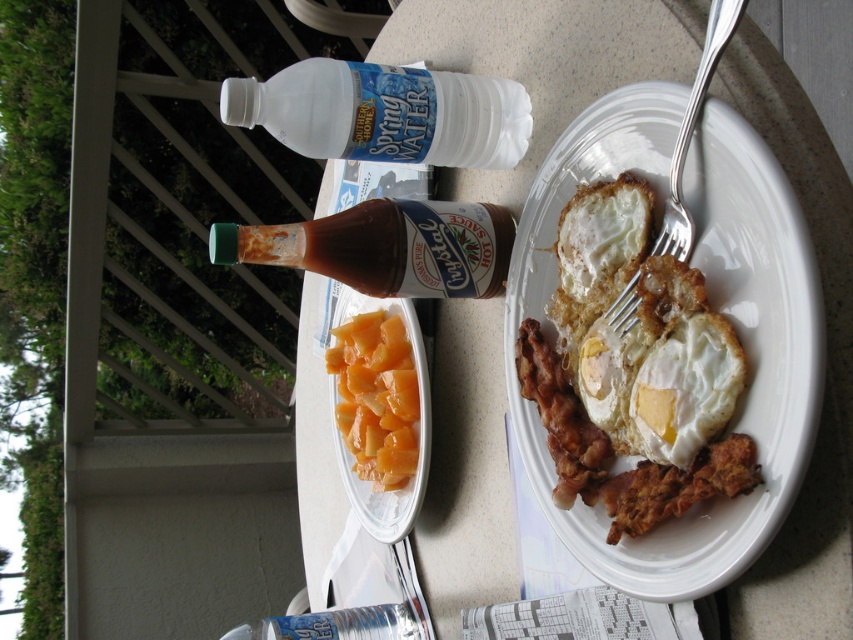
You are a waiter who needs to clear the dishes from the table. When you look at the white glossy egg at plate center and the silver metallic fork at plate right, which one is closer to you?

The white glossy egg at plate center is closer to you because the silver metallic fork at plate right is behind it.

You are a food critic observing a breakfast plate. The plate has golden fried eggs at plate right and a white fried egg at plate center. Which fried egg is covering part of the other?

The golden fried eggs at plate right is positioned over white fried egg at plate center, so it is covering part of the white fried egg at plate center.

You are a chef preparing a breakfast plate. You have a golden fried eggs at plate right and a white glossy egg at plate center. Which egg takes up more space on the plate?

The golden fried eggs at plate right is larger in size than the white glossy egg at plate center, so it takes up more space on the plate.